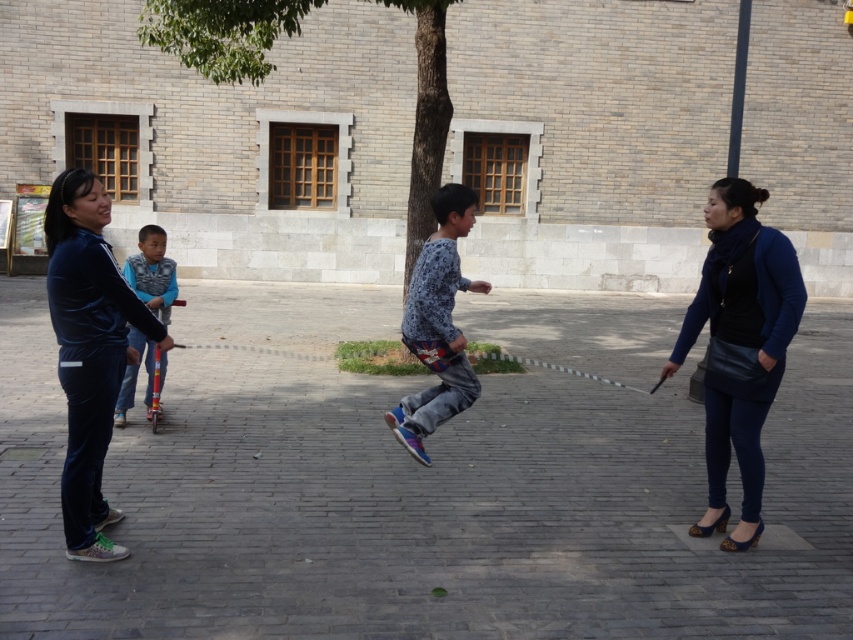
You are standing at the point with coordinates point (413,307) and want to walk towards the point with coordinates point (167,284). Based on the scene description, will you be moving towards the building in the background or away from it?

Since point (413,307) is in front of point (167,284), moving from point (413,307) towards point (167,284) means you are moving away from the building in the background.

You are standing in the public square and see both the blue leather jacket at lower right and the blue printed shirt at center. Which item is closer to you?

The blue leather jacket at lower right is closer to you since it is positioned in front of the blue printed shirt at center.

You are standing in the public square and need to place a blue leather jacket at lower right on the grassy area near the tree trunk. Can you confirm if the jacket is already placed correctly according to the scene?

The blue leather jacket at lower right is located at point (740, 346), which corresponds to the grassy area near the tree trunk. Therefore, the jacket is placed correctly.